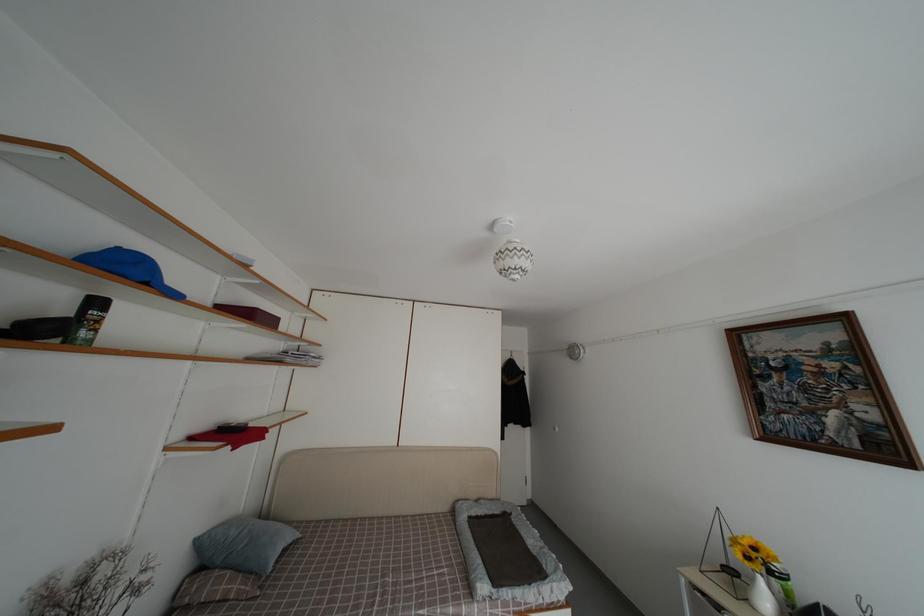
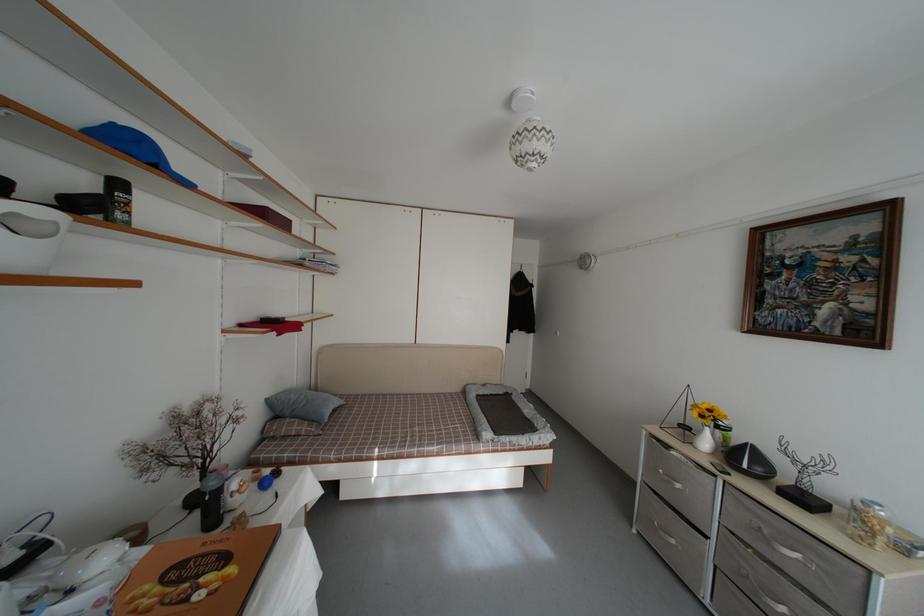
Where in the second image is the point corresponding to (223,580) from the first image?

(294, 427)